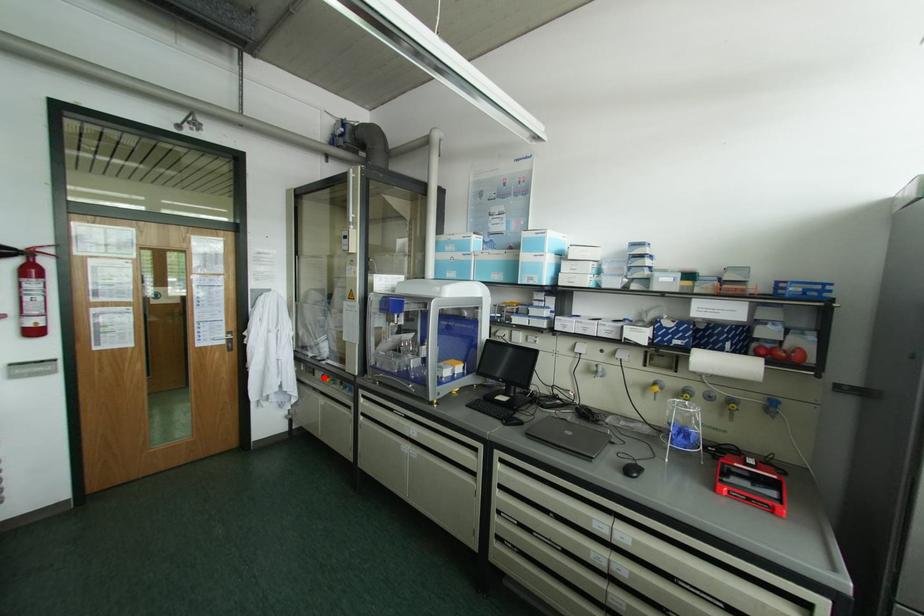
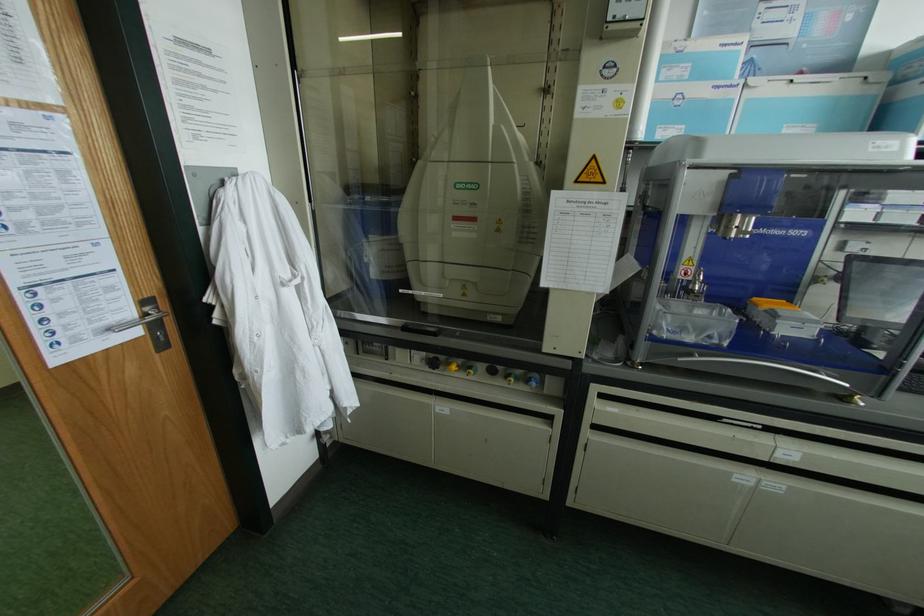
Locate, in the second image, the point that corresponds to the highlighted location in the first image.

(432, 363)